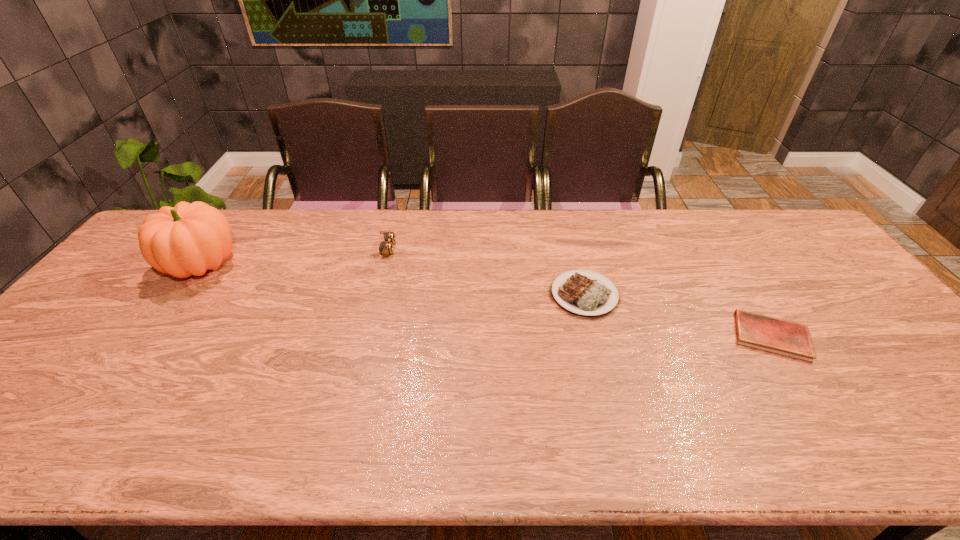
Where is `vacant area that lies between the pumpkin and the third object from left to right`? The height and width of the screenshot is (540, 960). vacant area that lies between the pumpkin and the third object from left to right is located at coordinates (393, 280).

Where is `object that is the third closest to the leftmost object`? The image size is (960, 540). object that is the third closest to the leftmost object is located at coordinates (770, 334).

Find the location of `object that stands as the second closest to the second object from right to left`. object that stands as the second closest to the second object from right to left is located at coordinates (385, 248).

At what (x,y) coordinates should I click in order to perform the action: click on vacant space that satisfies the following two spatial constraints: 1. on the back side of the diary; 2. through the lenses of the goggles. Please return your answer as a coordinate pair (x, y). Looking at the image, I should click on (715, 249).

Where is `blank area in the image that satisfies the following two spatial constraints: 1. through the lenses of the second object from left to right; 2. on the right side of the second object from right to left`? The image size is (960, 540). blank area in the image that satisfies the following two spatial constraints: 1. through the lenses of the second object from left to right; 2. on the right side of the second object from right to left is located at coordinates (374, 295).

The image size is (960, 540). Identify the location of vacant region that satisfies the following two spatial constraints: 1. through the lenses of the second object from left to right; 2. on the back side of the second object from right to left. [374, 295].

In order to click on blank area in the image that satisfies the following two spatial constraints: 1. on the back side of the third tallest object; 2. through the lenses of the second object from left to right in this screenshot , I will do `click(573, 249)`.

Locate an element on the screen. free location that satisfies the following two spatial constraints: 1. through the lenses of the goggles; 2. on the right side of the shortest object is located at coordinates (364, 336).

Where is `vacant space that satisfies the following two spatial constraints: 1. on the front side of the pumpkin; 2. on the left side of the plate`? vacant space that satisfies the following two spatial constraints: 1. on the front side of the pumpkin; 2. on the left side of the plate is located at coordinates (180, 295).

The height and width of the screenshot is (540, 960). I want to click on free space that satisfies the following two spatial constraints: 1. through the lenses of the shortest object; 2. on the left side of the goggles, so click(364, 336).